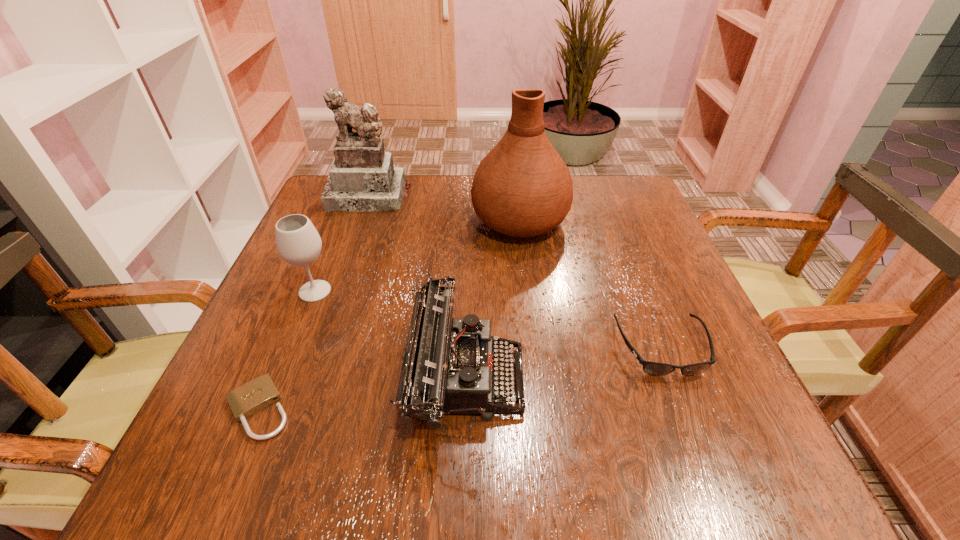
The height and width of the screenshot is (540, 960). Identify the location of vacant space located 0.160m on the keyboard of the fourth tallest object. (619, 376).

Where is `vacant space located on the front-facing side of the sunglasses`? vacant space located on the front-facing side of the sunglasses is located at coordinates (696, 437).

You are a GUI agent. You are given a task and a screenshot of the screen. Output one action in this format:
    pyautogui.click(x=<x>, y=<y>)
    Task: Click on the vacant space situated 0.200m on the right of the shortest object
    The image size is (960, 540).
    Given the screenshot: What is the action you would take?
    (420, 409)

At what (x,y) coordinates should I click in order to perform the action: click on pitcher at the far edge. Please return your answer as a coordinate pair (x, y). The image size is (960, 540). Looking at the image, I should click on point(522,188).

The height and width of the screenshot is (540, 960). In order to click on figurine present at the far edge in this screenshot , I will do `click(362, 177)`.

I want to click on typewriter that is positioned at the near edge, so click(x=449, y=365).

The height and width of the screenshot is (540, 960). I want to click on padlock present at the near edge, so click(x=254, y=396).

Where is `figurine that is at the left edge`? Image resolution: width=960 pixels, height=540 pixels. figurine that is at the left edge is located at coordinates (362, 177).

Identify the location of wineglass that is positioned at the left edge. The width and height of the screenshot is (960, 540). (298, 243).

This screenshot has height=540, width=960. In order to click on padlock that is at the left edge in this screenshot , I will do `click(254, 396)`.